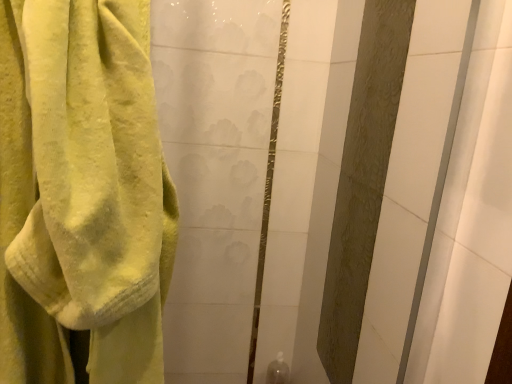
This screenshot has height=384, width=512. What do you see at coordinates (81, 195) in the screenshot?
I see `yellow plush towel at left` at bounding box center [81, 195].

Locate an element on the screen. This screenshot has height=384, width=512. yellow plush towel at left is located at coordinates (81, 195).

Identify the location of yellow plush towel at left. click(x=81, y=195).